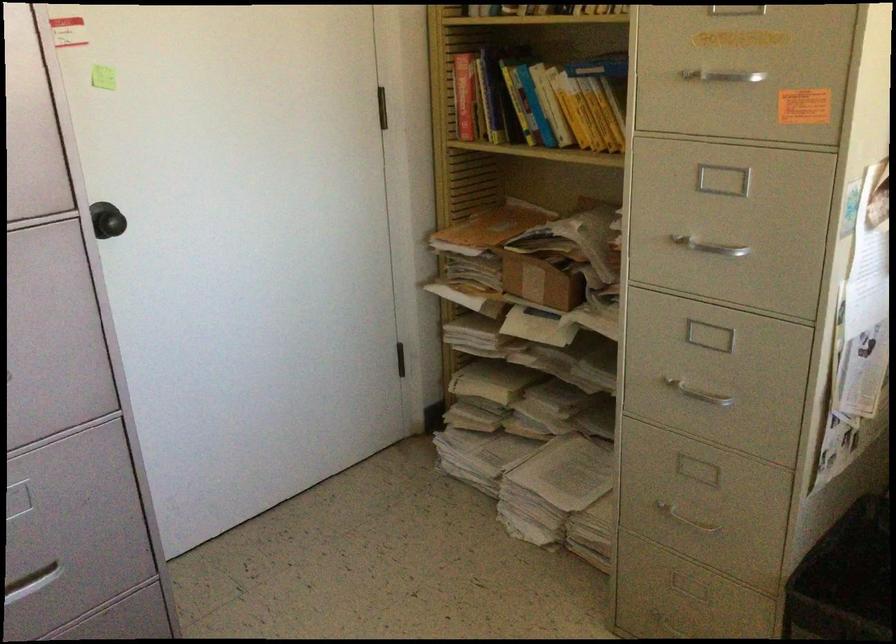
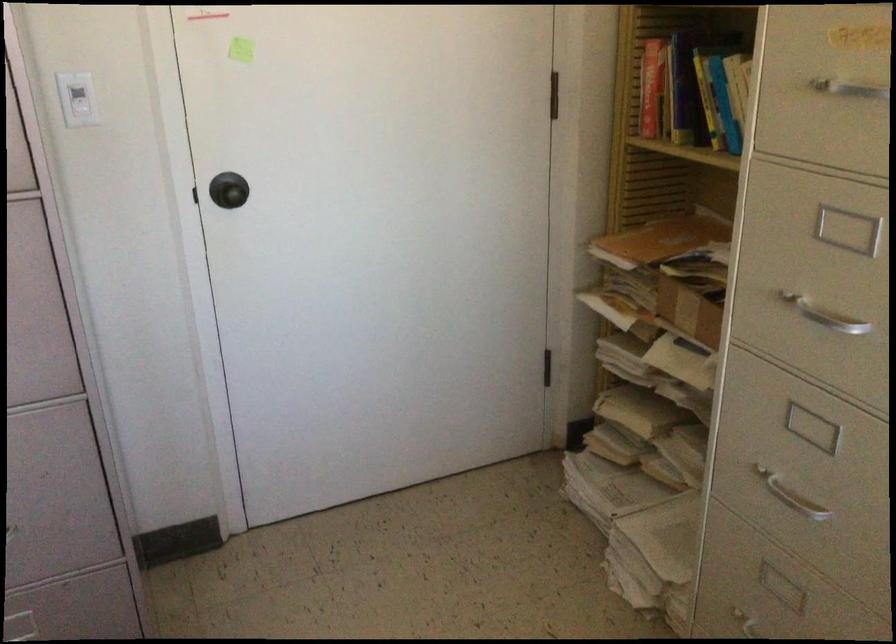
Question: I am providing you with two images of the same scene from different viewpoints. Please identify which objects are invisible in image2.

Choices:
 (A) yellow book
 (B) electrical outlet receptacle
 (C) white light switch
 (D) red book

Answer: (A)